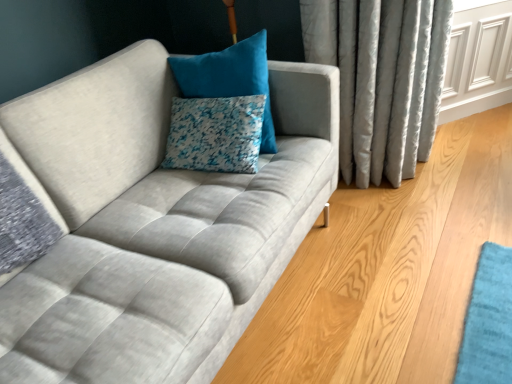
In order to face velvet blue pillow at upper center, which is the second pillow in bottom-to-top order, should I rotate leftwards or rightwards?

It's best to rotate left around 5.111 degrees.

Image resolution: width=512 pixels, height=384 pixels. In order to click on velvet blue pillow at upper center, which is the 1th pillow in top-to-bottom order in this screenshot , I will do `click(230, 78)`.

Describe the element at coordinates (230, 78) in the screenshot. This screenshot has width=512, height=384. I see `velvet blue pillow at upper center, which is the second pillow in bottom-to-top order` at that location.

How much space does white textured pillow at center, acting as the 2th pillow starting from the top, occupy vertically?

The height of white textured pillow at center, acting as the 2th pillow starting from the top, is 8.65 inches.

Where is `white textured pillow at center, which is counted as the 1th pillow, starting from the bottom`? Image resolution: width=512 pixels, height=384 pixels. white textured pillow at center, which is counted as the 1th pillow, starting from the bottom is located at coordinates (215, 134).

What do you see at coordinates (215, 134) in the screenshot? This screenshot has height=384, width=512. I see `white textured pillow at center, acting as the 2th pillow starting from the top` at bounding box center [215, 134].

Image resolution: width=512 pixels, height=384 pixels. I want to click on velvet blue pillow at upper center, which is the second pillow in bottom-to-top order, so click(230, 78).

Based on the photo, is velvet blue pillow at upper center, which is the 1th pillow in top-to-bottom order, at the right side of white textured pillow at center, acting as the 2th pillow starting from the top?

Yes, velvet blue pillow at upper center, which is the 1th pillow in top-to-bottom order, is to the right of white textured pillow at center, acting as the 2th pillow starting from the top.

In the image, is velvet blue pillow at upper center, which is the second pillow in bottom-to-top order, positioned in front of or behind white textured pillow at center, which is counted as the 1th pillow, starting from the bottom?

Visually, velvet blue pillow at upper center, which is the second pillow in bottom-to-top order, is located in front of white textured pillow at center, which is counted as the 1th pillow, starting from the bottom.

Is point (197, 62) positioned in front of point (181, 133)?

No, it is not.

From the image's perspective, does velvet blue pillow at upper center, which is the second pillow in bottom-to-top order, appear lower than white textured pillow at center, which is counted as the 1th pillow, starting from the bottom?

Actually, velvet blue pillow at upper center, which is the second pillow in bottom-to-top order, appears above white textured pillow at center, which is counted as the 1th pillow, starting from the bottom, in the image.

From a real-world perspective, which object stands above the other?

From a 3D spatial view, velvet blue pillow at upper center, which is the second pillow in bottom-to-top order, is above.

Is velvet blue pillow at upper center, which is the 1th pillow in top-to-bottom order, wider than white textured pillow at center, which is counted as the 1th pillow, starting from the bottom?

Yes.

Between velvet blue pillow at upper center, which is the 1th pillow in top-to-bottom order, and white textured pillow at center, acting as the 2th pillow starting from the top, which one has more height?

With more height is velvet blue pillow at upper center, which is the 1th pillow in top-to-bottom order.

Based on their sizes in the image, would you say velvet blue pillow at upper center, which is the second pillow in bottom-to-top order, is bigger or smaller than white textured pillow at center, which is counted as the 1th pillow, starting from the bottom?

Considering their sizes, velvet blue pillow at upper center, which is the second pillow in bottom-to-top order, takes up more space than white textured pillow at center, which is counted as the 1th pillow, starting from the bottom.

Looking at this image, is white textured pillow at center, acting as the 2th pillow starting from the top, a part of velvet blue pillow at upper center, which is the second pillow in bottom-to-top order?

No.

Is velvet blue pillow at upper center, which is the second pillow in bottom-to-top order, placed right next to white textured pillow at center, acting as the 2th pillow starting from the top?

They are not placed beside each other.

Is velvet blue pillow at upper center, which is the second pillow in bottom-to-top order, facing away from white textured pillow at center, acting as the 2th pillow starting from the top?

No, velvet blue pillow at upper center, which is the second pillow in bottom-to-top order,'s orientation is not away from white textured pillow at center, acting as the 2th pillow starting from the top.

How different are the orientations of velvet blue pillow at upper center, which is the second pillow in bottom-to-top order, and white textured pillow at center, which is counted as the 1th pillow, starting from the bottom, in degrees?

The facing directions of velvet blue pillow at upper center, which is the second pillow in bottom-to-top order, and white textured pillow at center, which is counted as the 1th pillow, starting from the bottom, are 10.9 degrees apart.

There is a white textured pillow at center, which is counted as the 1th pillow, starting from the bottom. Where is `pillow above it (from a real-world perspective)`? The image size is (512, 384). pillow above it (from a real-world perspective) is located at coordinates (230, 78).

Does white textured pillow at center, acting as the 2th pillow starting from the top, appear on the right side of velvet blue pillow at upper center, which is the second pillow in bottom-to-top order?

In fact, white textured pillow at center, acting as the 2th pillow starting from the top, is to the left of velvet blue pillow at upper center, which is the second pillow in bottom-to-top order.

Is white textured pillow at center, acting as the 2th pillow starting from the top, further to the viewer compared to velvet blue pillow at upper center, which is the second pillow in bottom-to-top order?

Yes, the depth of white textured pillow at center, acting as the 2th pillow starting from the top, is greater than that of velvet blue pillow at upper center, which is the second pillow in bottom-to-top order.

Which is in front, point (203, 163) or point (242, 66)?

The point (242, 66) is more forward.

From the image's perspective, is white textured pillow at center, which is counted as the 1th pillow, starting from the bottom, below velvet blue pillow at upper center, which is the 1th pillow in top-to-bottom order?

Yes, from the image's perspective, white textured pillow at center, which is counted as the 1th pillow, starting from the bottom, is beneath velvet blue pillow at upper center, which is the 1th pillow in top-to-bottom order.

From a real-world perspective, which is physically above, white textured pillow at center, acting as the 2th pillow starting from the top, or velvet blue pillow at upper center, which is the 1th pillow in top-to-bottom order?

velvet blue pillow at upper center, which is the 1th pillow in top-to-bottom order.

Considering the relative sizes of white textured pillow at center, which is counted as the 1th pillow, starting from the bottom, and velvet blue pillow at upper center, which is the second pillow in bottom-to-top order, in the image provided, is white textured pillow at center, which is counted as the 1th pillow, starting from the bottom, thinner than velvet blue pillow at upper center, which is the second pillow in bottom-to-top order,?

Yes, white textured pillow at center, which is counted as the 1th pillow, starting from the bottom, is thinner than velvet blue pillow at upper center, which is the second pillow in bottom-to-top order.

Considering the relative sizes of white textured pillow at center, which is counted as the 1th pillow, starting from the bottom, and velvet blue pillow at upper center, which is the 1th pillow in top-to-bottom order, in the image provided, is white textured pillow at center, which is counted as the 1th pillow, starting from the bottom, shorter than velvet blue pillow at upper center, which is the 1th pillow in top-to-bottom order,?

Yes, white textured pillow at center, which is counted as the 1th pillow, starting from the bottom, is shorter than velvet blue pillow at upper center, which is the 1th pillow in top-to-bottom order.

Between white textured pillow at center, acting as the 2th pillow starting from the top, and velvet blue pillow at upper center, which is the second pillow in bottom-to-top order, which one has smaller size?

white textured pillow at center, acting as the 2th pillow starting from the top, is smaller.

Is white textured pillow at center, which is counted as the 1th pillow, starting from the bottom, completely or partially outside of velvet blue pillow at upper center, which is the second pillow in bottom-to-top order?

Yes, white textured pillow at center, which is counted as the 1th pillow, starting from the bottom, is not within velvet blue pillow at upper center, which is the second pillow in bottom-to-top order.

Are white textured pillow at center, which is counted as the 1th pillow, starting from the bottom, and velvet blue pillow at upper center, which is the second pillow in bottom-to-top order, located far from each other?

No, white textured pillow at center, which is counted as the 1th pillow, starting from the bottom, is in close proximity to velvet blue pillow at upper center, which is the second pillow in bottom-to-top order.

Is white textured pillow at center, acting as the 2th pillow starting from the top, facing towards velvet blue pillow at upper center, which is the 1th pillow in top-to-bottom order?

No, white textured pillow at center, acting as the 2th pillow starting from the top, does not turn towards velvet blue pillow at upper center, which is the 1th pillow in top-to-bottom order.

What's the angular difference between white textured pillow at center, acting as the 2th pillow starting from the top, and velvet blue pillow at upper center, which is the second pillow in bottom-to-top order,'s facing directions?

white textured pillow at center, acting as the 2th pillow starting from the top, and velvet blue pillow at upper center, which is the second pillow in bottom-to-top order, are facing 10.9 degrees away from each other.

You are a GUI agent. You are given a task and a screenshot of the screen. Output one action in this format:
    pyautogui.click(x=<x>, y=<y>)
    Task: Click on the pillow above the white textured pillow at center, acting as the 2th pillow starting from the top (from the image's perspective)
    Image resolution: width=512 pixels, height=384 pixels.
    Given the screenshot: What is the action you would take?
    pyautogui.click(x=230, y=78)

The height and width of the screenshot is (384, 512). I want to click on pillow below the velvet blue pillow at upper center, which is the 1th pillow in top-to-bottom order (from a real-world perspective), so click(215, 134).

Locate an element on the screen. pillow that is behind the velvet blue pillow at upper center, which is the second pillow in bottom-to-top order is located at coordinates (215, 134).